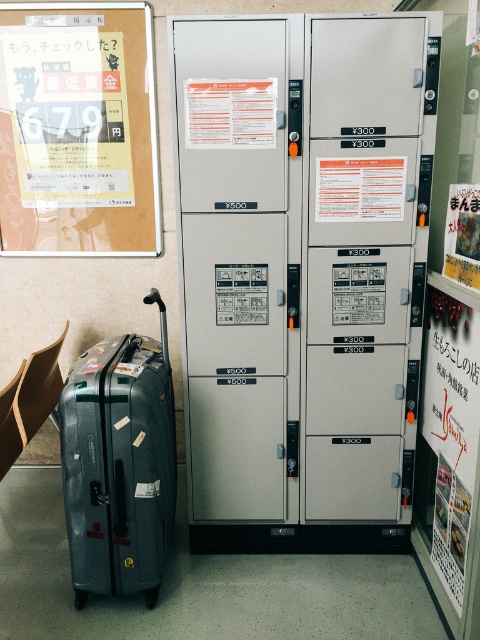
Does matte paper poster at right have a greater width compared to white glossy poster at center?

In fact, matte paper poster at right might be narrower than white glossy poster at center.

Which is below, matte paper poster at right or white glossy poster at center?

white glossy poster at center is below.

Which is in front, point (448, 243) or point (367, 307)?

Point (448, 243) is in front.

Image resolution: width=480 pixels, height=640 pixels. In order to click on matte paper poster at right in this screenshot , I will do `click(463, 234)`.

Does matte cardboard poster at upper left appear on the right side of white glossy poster at center?

In fact, matte cardboard poster at upper left is to the left of white glossy poster at center.

Between matte cardboard poster at upper left and white glossy poster at center, which one has less height?

Standing shorter between the two is white glossy poster at center.

Does point (128, 22) lie behind point (351, 284)?

That is True.

Locate an element on the screen. matte cardboard poster at upper left is located at coordinates (78, 131).

Which of these two, white paper poster at center or matte plastic poster at center, stands taller?

Standing taller between the two is matte plastic poster at center.

Find the location of a particular element. Image resolution: width=480 pixels, height=640 pixels. white paper poster at center is located at coordinates (360, 188).

This screenshot has width=480, height=640. In order to click on white paper poster at center in this screenshot , I will do `click(360, 188)`.